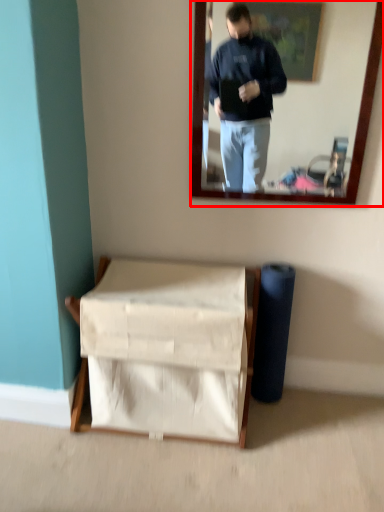
Question: In this image, where is mirror (annotated by the red box) located relative to furniture?

Choices:
 (A) right
 (B) left

Answer: (A)